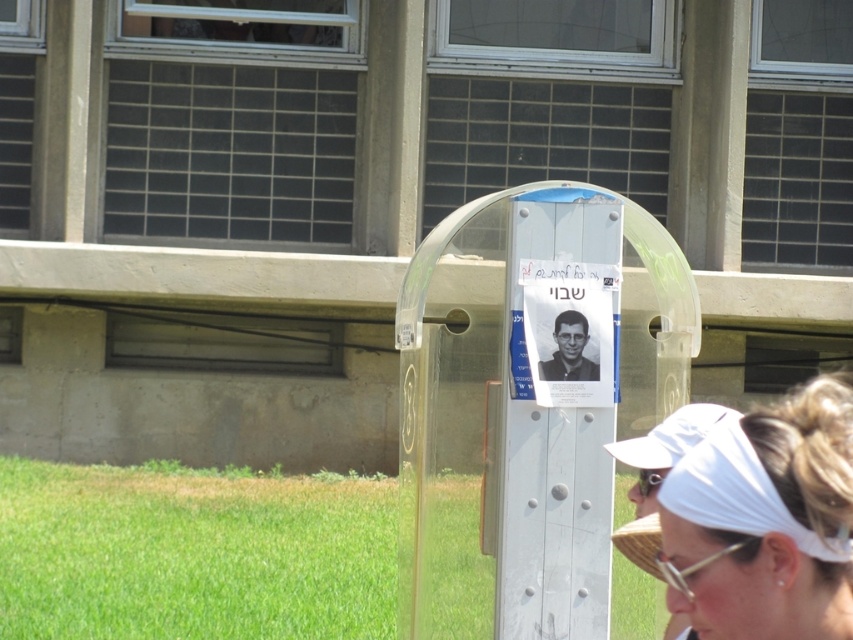
You are standing in the outdoor scene and want to determine the relative positions of the white fabric headband at lower right and the clear plastic goggles at center. Which object is closer to you?

The white fabric headband at lower right is closer to you because it is in front of the clear plastic goggles at center.

You are a maintenance worker needing to replace a broken item. You have a ladder that is 9 feet tall. The black matte photo frame at center is at your eye level. Can you reach the clear plastic goggles at center with the ladder without moving it?

The distance between the black matte photo frame at center and the clear plastic goggles at center is 10.06 feet. Since the ladder is only 9 feet tall, you cannot reach the clear plastic goggles at center with the ladder without moving it.